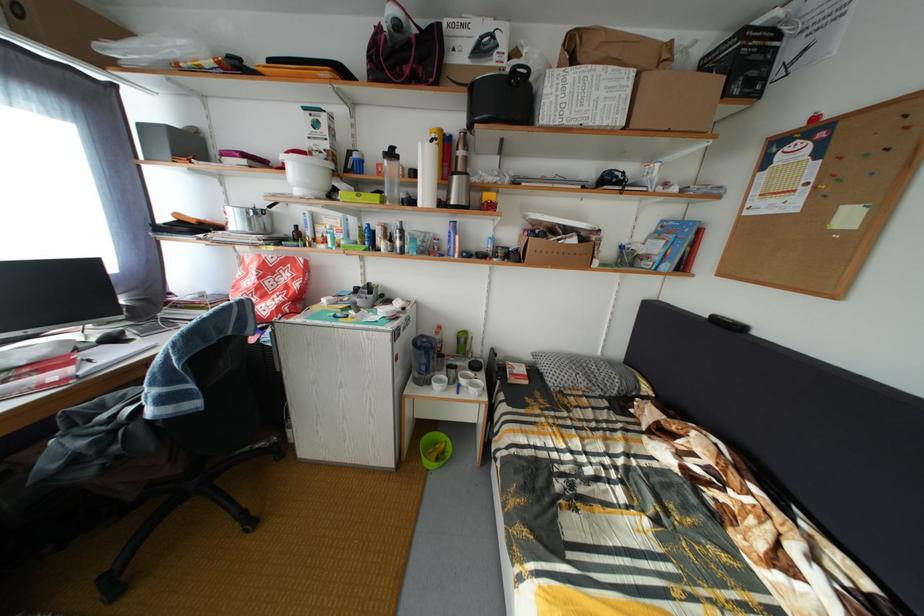
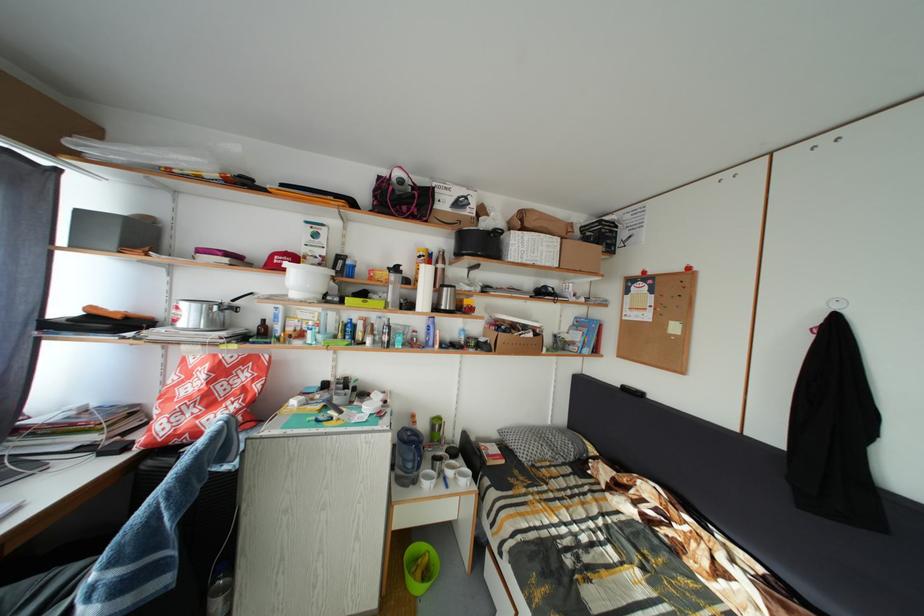
The images are taken continuously from a first-person perspective. In which direction are you moving?

The cameraman moved toward left, backward.